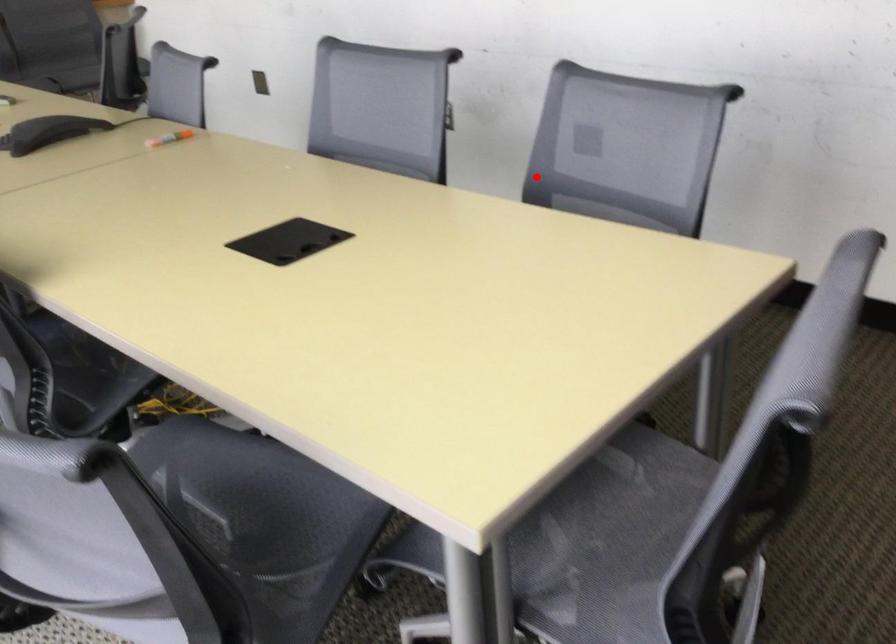
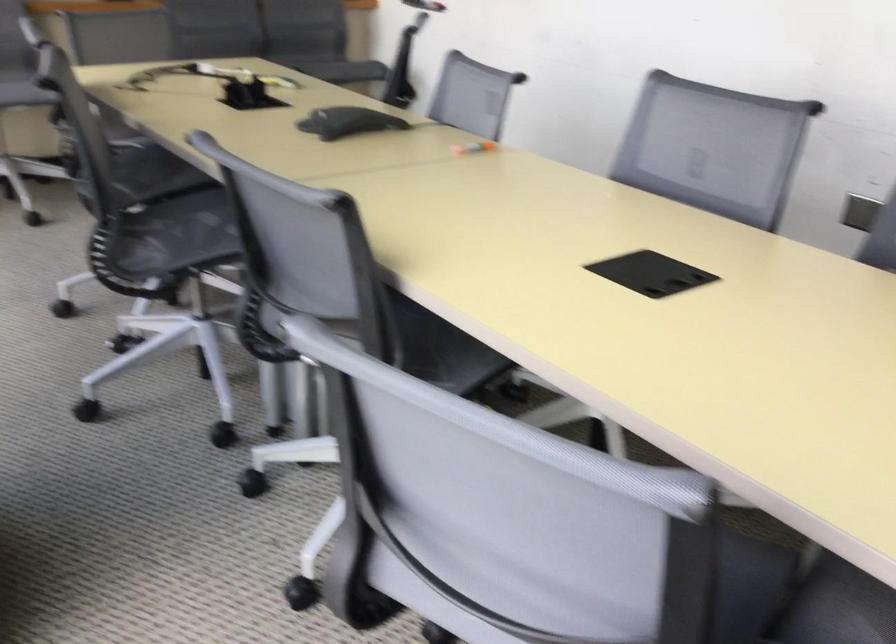
Question: A red point is marked in image1. In image2, is the corresponding 3D point closer to the camera or farther? Reply with the corresponding letter.

Choices:
 (A) The corresponding 3D point is closer.
 (B) The corresponding 3D point is farther.

Answer: (A)